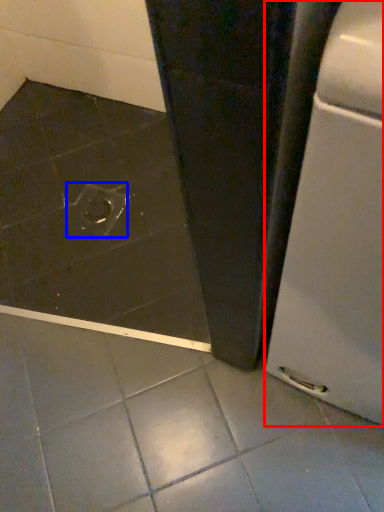
Question: Which object appears closest to the camera in this image, home appliance (highlighted by a red box) or drain (highlighted by a blue box)?

Choices:
 (A) home appliance
 (B) drain

Answer: (A)